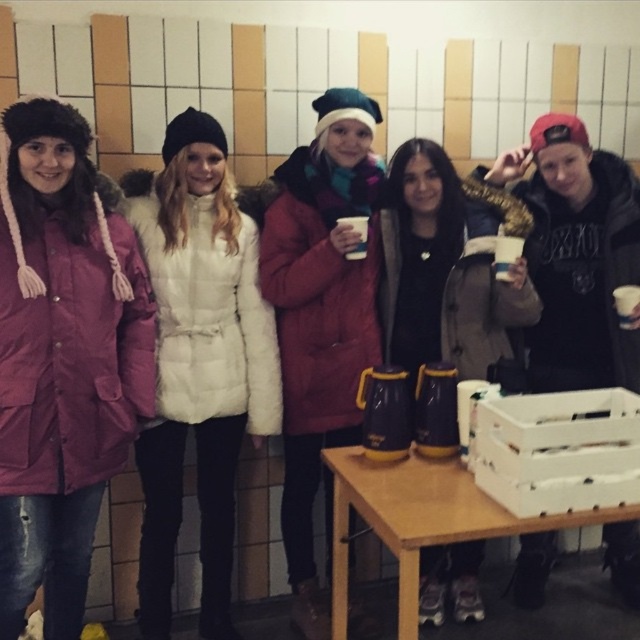
Can you confirm if matte pink coat at left is wider than white plastic crate at lower right?

No, matte pink coat at left is not wider than white plastic crate at lower right.

This screenshot has height=640, width=640. I want to click on matte pink coat at left, so click(x=61, y=358).

From the picture: Can you confirm if matte pink coat at left is bigger than white fur coat at center?

Incorrect, matte pink coat at left is not larger than white fur coat at center.

Between matte pink coat at left and white fur coat at center, which one has more height?

Standing taller between the two is white fur coat at center.

Is point (13, 132) farther from camera compared to point (172, 484)?

No, (13, 132) is closer to viewer.

I want to click on matte pink coat at left, so click(61, 358).

Between white fur coat at center and white plastic crate at lower right, which one appears on the right side from the viewer's perspective?

From the viewer's perspective, white plastic crate at lower right appears more on the right side.

Looking at this image, between white fur coat at center and white plastic crate at lower right, which one appears on the left side from the viewer's perspective?

Positioned to the left is white fur coat at center.

Between point (218, 560) and point (540, 412), which one is positioned in front?

Point (540, 412) is in front.

Locate an element on the screen. white fur coat at center is located at coordinates (198, 362).